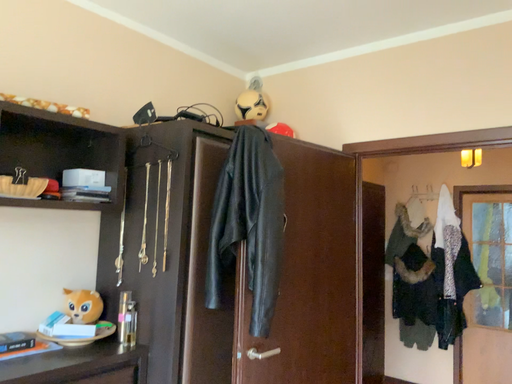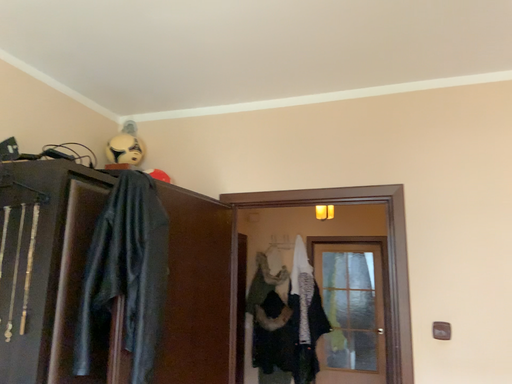
Question: Which way did the camera rotate in the video?

Choices:
 (A) rotated left
 (B) rotated right

Answer: (B)